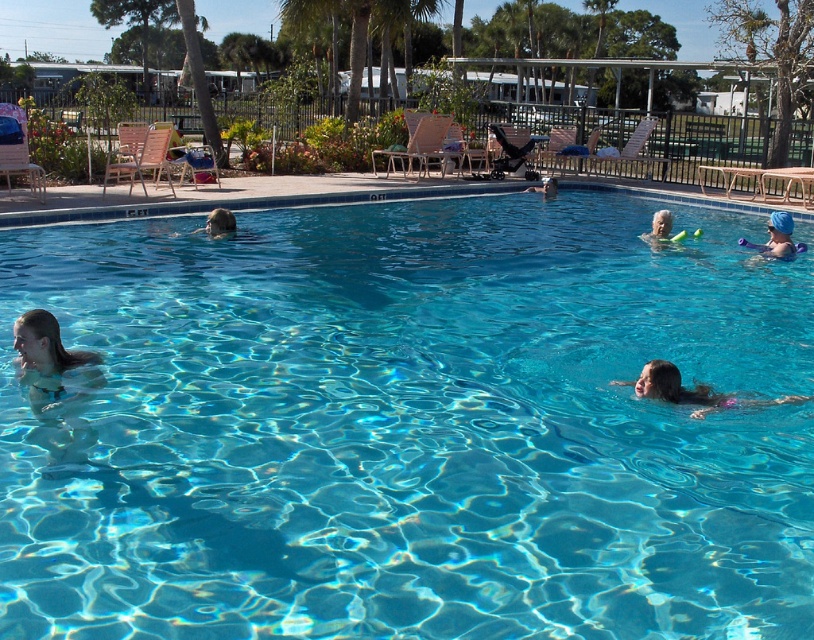
Is point (62, 362) less distant than point (701, 387)?

Yes, point (62, 362) is in front of point (701, 387).

Does point (55, 324) come farther from viewer compared to point (668, 369)?

No, it is in front of (668, 369).

The width and height of the screenshot is (814, 640). I want to click on light brown hair at lower left, so click(49, 358).

Which is more to the left, transparent blue water at center or smooth skin head at center?

smooth skin head at center is more to the left.

Is point (441, 292) farther from camera compared to point (222, 234)?

No.

From the picture: Measure the distance between point (423, 472) and camera.

Point (423, 472) is 4.25 meters from camera.

The height and width of the screenshot is (640, 814). I want to click on transparent blue water at center, so click(x=408, y=428).

Does white rubber ring at upper right appear on the right side of smooth skin person at center?

Correct, you'll find white rubber ring at upper right to the right of smooth skin person at center.

Who is more distant from viewer, (666, 241) or (543, 180)?

Point (543, 180)

This screenshot has height=640, width=814. What are the coordinates of `white rubber ring at upper right` in the screenshot? It's located at (661, 230).

Where is `white rubber ring at upper right`? The height and width of the screenshot is (640, 814). white rubber ring at upper right is located at coordinates (661, 230).